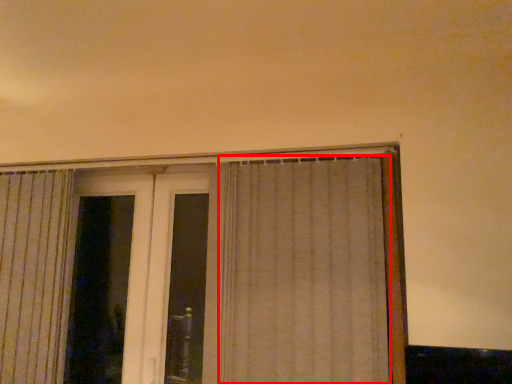
Question: From the image's perspective, where is curtain (annotated by the red box) located in relation to screen door in the image?

Choices:
 (A) below
 (B) above

Answer: (B)